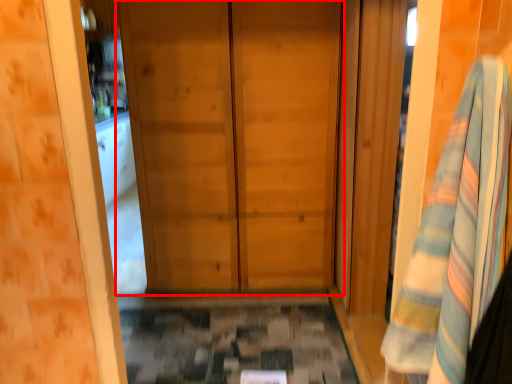
Question: Considering the relative positions of door (annotated by the red box) and bath towel in the image provided, where is door (annotated by the red box) located with respect to the staircase?

Choices:
 (A) right
 (B) left

Answer: (B)